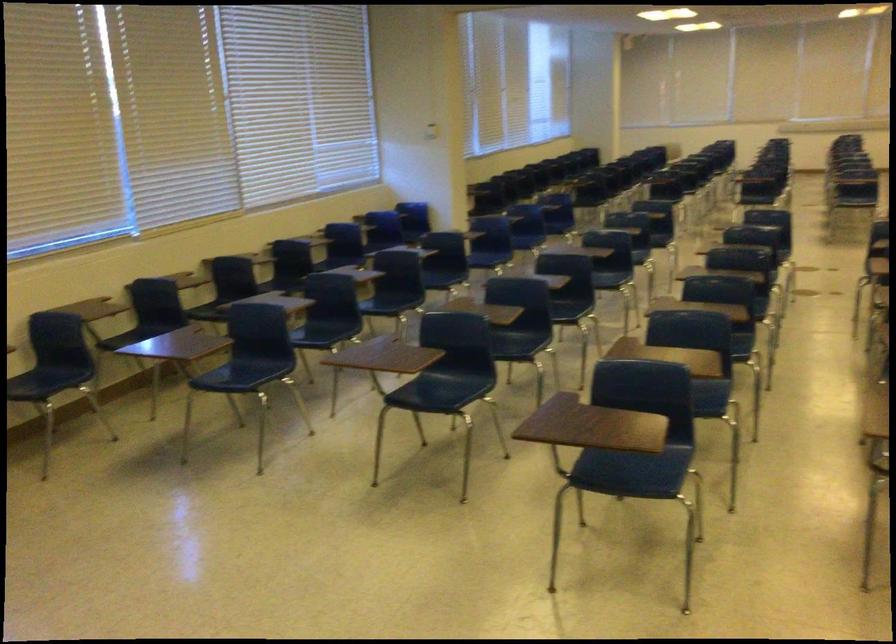
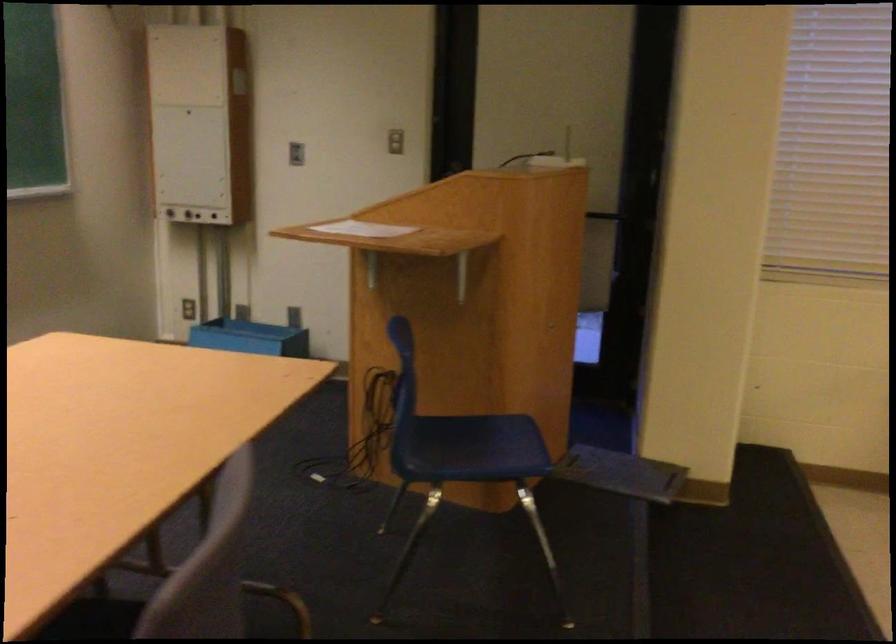
Question: The images are taken continuously from a first-person perspective. In which direction is your viewpoint rotating?

Choices:
 (A) Left
 (B) Right
 (C) Up
 (D) Down

Answer: (A)